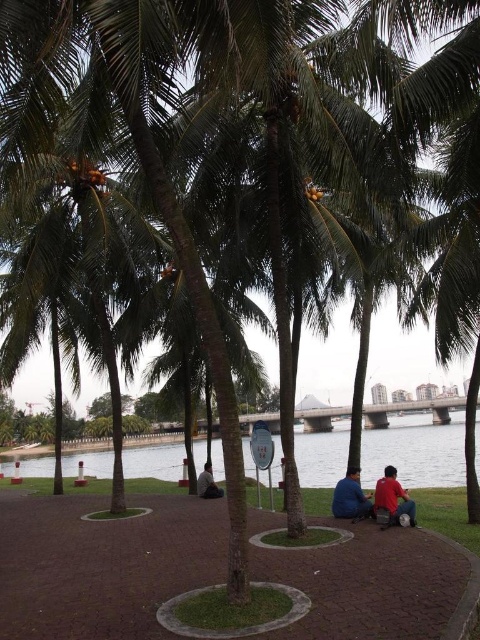
Question: Does clear water at lower center appear on the right side of matte red shirt at lower right?

Choices:
 (A) no
 (B) yes

Answer: (A)

Question: Which object is farther from the camera taking this photo?

Choices:
 (A) dark gray fabric shirt at center
 (B) clear water at lower center
 (C) matte red shirt at lower right

Answer: (A)

Question: Based on their relative distances, which object is nearer to the clear water at lower center?

Choices:
 (A) blue fabric pants at lower center
 (B) matte red shirt at lower right

Answer: (A)

Question: Considering the relative positions of clear water at lower center and dark gray fabric shirt at center in the image provided, where is clear water at lower center located with respect to dark gray fabric shirt at center?

Choices:
 (A) left
 (B) right

Answer: (A)

Question: Among these points, which one is nearest to the camera?

Choices:
 (A) (313, 460)
 (B) (343, 481)
 (C) (211, 476)

Answer: (B)

Question: In this image, where is matte red shirt at center located relative to blue fabric pants at lower center?

Choices:
 (A) below
 (B) above

Answer: (B)